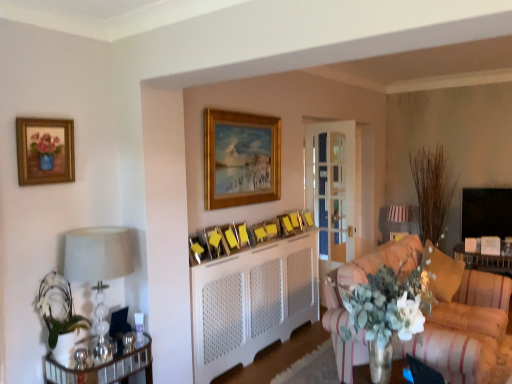
Describe the element at coordinates (252, 302) in the screenshot. This screenshot has height=384, width=512. I see `white textured radiator at center` at that location.

What do you see at coordinates (241, 159) in the screenshot?
I see `gold-framed painting at upper center, the eighth picture frame in the back-to-front sequence` at bounding box center [241, 159].

Find the location of a particular element. white glass lampshade at left, placed as the first lamp when sorted from left to right is located at coordinates (98, 268).

Locate an element on the screen. This screenshot has height=384, width=512. metallic gold picture frame at center, which is the tenth picture frame in back-to-front order is located at coordinates (196, 249).

The image size is (512, 384). What are the coordinates of `striped fabric couch at lower right` in the screenshot? It's located at (464, 330).

Identify the location of white textured radiator at center. (252, 302).

Is striped fabric couch at lower right turned away from wooden picture frame at center, marked as the 2th picture frame in a back-to-front arrangement?

No.

Can you tell me how much striped fabric couch at lower right and wooden picture frame at center, positioned as the 10th picture frame in front-to-back order, differ in facing direction?

They differ by 69.1 degrees in their facing directions.

Does striped fabric couch at lower right have a greater width compared to wooden picture frame at center, positioned as the 10th picture frame in front-to-back order?

Yes, striped fabric couch at lower right is wider than wooden picture frame at center, positioned as the 10th picture frame in front-to-back order.

Consider the image. From the image's perspective, who appears lower, striped fabric couch at lower right or wooden picture frame at center, positioned as the 10th picture frame in front-to-back order?

striped fabric couch at lower right.

In the image, is wooden picture frame at center, the 9th picture frame positioned from the front, positioned in front of or behind velvet gold pillow at right?

In the image, wooden picture frame at center, the 9th picture frame positioned from the front, appears behind velvet gold pillow at right.

Looking at this image, is wooden picture frame at center, which ranks as the 3th picture frame in back-to-front order, bigger or smaller than velvet gold pillow at right?

Considering their sizes, wooden picture frame at center, which ranks as the 3th picture frame in back-to-front order, takes up less space than velvet gold pillow at right.

Are wooden picture frame at center, the 9th picture frame positioned from the front, and velvet gold pillow at right located far from each other?

Absolutely, wooden picture frame at center, the 9th picture frame positioned from the front, is distant from velvet gold pillow at right.

Is matte yellow picture frame at center, positioned as the seventh picture frame in front-to-back order, aimed at metallic mirrored table at left?

No, matte yellow picture frame at center, positioned as the seventh picture frame in front-to-back order, is not aimed at metallic mirrored table at left.

What's the angular difference between matte yellow picture frame at center, positioned as the seventh picture frame in front-to-back order, and metallic mirrored table at left's facing directions?

They differ by 5.3 degrees in their facing directions.

Considering the relative positions of matte yellow picture frame at center, placed as the 5th picture frame when sorted from back to front, and metallic mirrored table at left in the image provided, is matte yellow picture frame at center, placed as the 5th picture frame when sorted from back to front, to the left or to the right of metallic mirrored table at left?

matte yellow picture frame at center, placed as the 5th picture frame when sorted from back to front, is positioned on metallic mirrored table at left's right side.

How distant is matte yellow picture frame at center, placed as the 5th picture frame when sorted from back to front, from metallic mirrored table at left?

1.48 meters.

Are wooden picture frame at center, the eighth picture frame viewed from the front, and white glass lampshade at left, which ranks as the second lamp in back-to-front order, located far from each other?

Yes, wooden picture frame at center, the eighth picture frame viewed from the front, and white glass lampshade at left, which ranks as the second lamp in back-to-front order, are quite far apart.

Which is in front, wooden picture frame at center, which is the fourth picture frame in back-to-front order, or white glass lampshade at left, placed as the first lamp when sorted from left to right?

white glass lampshade at left, placed as the first lamp when sorted from left to right, is in front.

Is wooden picture frame at center, which is the fourth picture frame in back-to-front order, wider than white glass lampshade at left, placed as the first lamp when sorted from left to right?

No, wooden picture frame at center, which is the fourth picture frame in back-to-front order, is not wider than white glass lampshade at left, placed as the first lamp when sorted from left to right.

From the image's perspective, is wooden picture frame at center, which ranks as the 3th picture frame in back-to-front order, above or below wooden picture frame at center, marked as the 2th picture frame in a back-to-front arrangement?

wooden picture frame at center, which ranks as the 3th picture frame in back-to-front order, is situated lower than wooden picture frame at center, marked as the 2th picture frame in a back-to-front arrangement, in the image.

Find the location of `the 1st picture frame directly beneath the wooden picture frame at center, marked as the 2th picture frame in a back-to-front arrangement (from a real-world perspective)`. the 1st picture frame directly beneath the wooden picture frame at center, marked as the 2th picture frame in a back-to-front arrangement (from a real-world perspective) is located at coordinates (286, 225).

How distant is wooden picture frame at center, the 9th picture frame positioned from the front, from wooden picture frame at center, marked as the 2th picture frame in a back-to-front arrangement?

They are 3.03 inches apart.

From a real-world perspective, which object rests below the other?

wooden picture frame at center, which ranks as the 3th picture frame in back-to-front order, is physically lower.

Considering the relative sizes of gold-framed picture at center, marked as the first picture frame in a back-to-front arrangement, and wooden picture frame at center, acting as the sixth picture frame starting from the back, in the image provided, is gold-framed picture at center, marked as the first picture frame in a back-to-front arrangement, thinner than wooden picture frame at center, acting as the sixth picture frame starting from the back,?

Indeed, gold-framed picture at center, marked as the first picture frame in a back-to-front arrangement, has a lesser width compared to wooden picture frame at center, acting as the sixth picture frame starting from the back.

Is gold-framed picture at center, which appears as the eleventh picture frame when viewed from the front, outside of wooden picture frame at center, the sixth picture frame when ordered from front to back?

Yes, gold-framed picture at center, which appears as the eleventh picture frame when viewed from the front, is located beyond the bounds of wooden picture frame at center, the sixth picture frame when ordered from front to back.

Would you consider gold-framed picture at center, which appears as the eleventh picture frame when viewed from the front, to be distant from wooden picture frame at center, acting as the sixth picture frame starting from the back?

gold-framed picture at center, which appears as the eleventh picture frame when viewed from the front, is actually quite close to wooden picture frame at center, acting as the sixth picture frame starting from the back.

Does gold-framed picture at center, marked as the first picture frame in a back-to-front arrangement, have a smaller size compared to wooden picture frame at center, the sixth picture frame when ordered from front to back?

Indeed, gold-framed picture at center, marked as the first picture frame in a back-to-front arrangement, has a smaller size compared to wooden picture frame at center, the sixth picture frame when ordered from front to back.

Is gold-framed painting at upper center, which ranks as the fourth picture frame in front-to-back order, further to the viewer compared to gold-framed picture at center, which appears as the eleventh picture frame when viewed from the front?

No, the depth of gold-framed painting at upper center, which ranks as the fourth picture frame in front-to-back order, is less than that of gold-framed picture at center, which appears as the eleventh picture frame when viewed from the front.

Does point (278, 120) lie behind point (310, 213)?

No.

Is gold-framed picture at center, marked as the first picture frame in a back-to-front arrangement, at the back of gold-framed painting at upper center, the eighth picture frame in the back-to-front sequence?

gold-framed painting at upper center, the eighth picture frame in the back-to-front sequence, is not turned away from gold-framed picture at center, marked as the first picture frame in a back-to-front arrangement.

Find the location of a particular element. This screenshot has width=512, height=384. studio couch below the wooden picture frame at center, marked as the 2th picture frame in a back-to-front arrangement (from the image's perspective) is located at coordinates (464, 330).

From the velvet gold pillow at right, count the 3rd picture frame to the left and point to it. Please provide its 2D coordinates.

[(286, 225)]

Which object lies further to the anchor point white glass lampshade at left, placed as the first lamp when sorted from front to back, gold-framed painting at upper center, which ranks as the fourth picture frame in front-to-back order, or metallic gold picture frame at center, the second picture frame when ordered from front to back?

The object further to white glass lampshade at left, placed as the first lamp when sorted from front to back, is gold-framed painting at upper center, which ranks as the fourth picture frame in front-to-back order.

Which object lies nearer to the anchor point metallic mirrored table at left, yellow paper at center, which ranks as the 5th picture frame in front-to-back order, or striped fabric couch at lower right?

Among the two, yellow paper at center, which ranks as the 5th picture frame in front-to-back order, is located nearer to metallic mirrored table at left.

Based on the photo, when comparing their distances from wooden picture frame at center, which ranks as the 3th picture frame in back-to-front order, does gold-framed picture at center, which appears as the eleventh picture frame when viewed from the front, or wooden picture frame at center, the eighth picture frame viewed from the front, seem further?

→ gold-framed picture at center, which appears as the eleventh picture frame when viewed from the front, is further to wooden picture frame at center, which ranks as the 3th picture frame in back-to-front order.

Looking at the image, which one is located further to white textured radiator at center, wooden picture frame at center, the eighth picture frame viewed from the front, or yellow paper at center, the 7th picture frame positioned from the back?

wooden picture frame at center, the eighth picture frame viewed from the front.

Based on their spatial positions, is yellow paper at center, the 7th picture frame positioned from the back, or metallic gold picture frame at center, which is the tenth picture frame in back-to-front order, closer to wooden picture frame at center, marked as the 2th picture frame in a back-to-front arrangement?

yellow paper at center, the 7th picture frame positioned from the back.

From the image, which object appears to be farther from velvet gold pillow at right, striped fabric couch at lower right or wooden picture frame at center, marked as the 2th picture frame in a back-to-front arrangement?

wooden picture frame at center, marked as the 2th picture frame in a back-to-front arrangement, is further to velvet gold pillow at right.

Based on their spatial positions, is wooden picture frame at center, the eighth picture frame viewed from the front, or matte yellow picture frame at center, positioned as the seventh picture frame in front-to-back order, further from gold-framed painting at upper left, positioned as the 11th picture frame in back-to-front order?

wooden picture frame at center, the eighth picture frame viewed from the front.

Based on the photo, which object lies nearer to the anchor point white glass lampshade at left, which ranks as the second lamp in back-to-front order, white textured radiator at center or gold-framed painting at upper left, marked as the 1th picture frame in a front-to-back arrangement?

Based on the image, gold-framed painting at upper left, marked as the 1th picture frame in a front-to-back arrangement, appears to be nearer to white glass lampshade at left, which ranks as the second lamp in back-to-front order.

Identify the location of fireplace located between striped fabric couch at lower right and metallic gold picture frame at center, which is the tenth picture frame in back-to-front order, in the depth direction. This screenshot has width=512, height=384. (252, 302).

Image resolution: width=512 pixels, height=384 pixels. Find the location of `fireplace between wooden picture frame at center, placed as the 3th picture frame when sorted from front to back, and velvet gold pillow at right`. fireplace between wooden picture frame at center, placed as the 3th picture frame when sorted from front to back, and velvet gold pillow at right is located at coordinates (252, 302).

Find the location of a particular element. The image size is (512, 384). floral arrangement located between white glass lampshade at left, placed as the first lamp when sorted from front to back, and wooden picture frame at center, the 9th picture frame in the back-to-front sequence, in the depth direction is located at coordinates click(x=58, y=308).

Find the location of a particular element. The height and width of the screenshot is (384, 512). fireplace between metallic mirrored table at left and wooden picture frame at center, placed as the 3th picture frame when sorted from front to back, in the front-back direction is located at coordinates (252, 302).